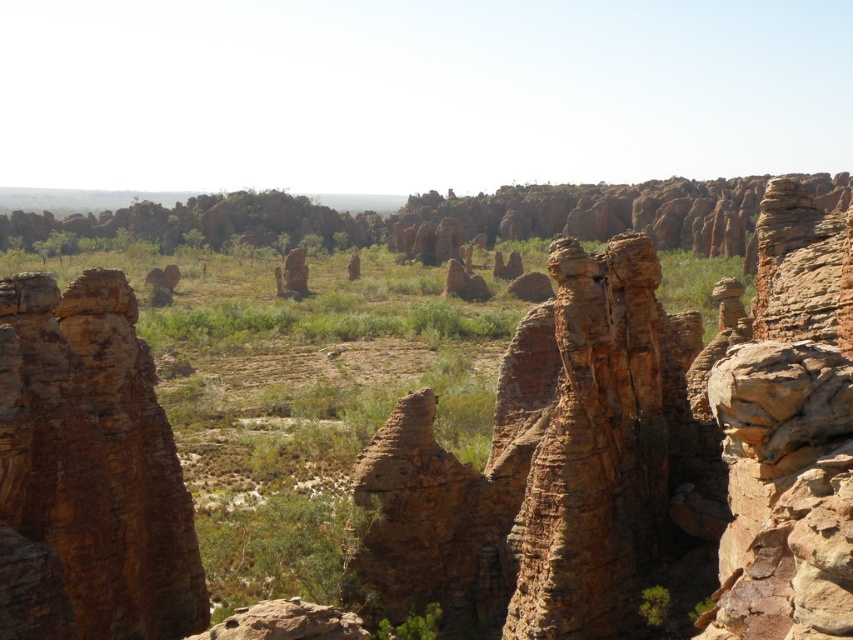
You are standing at the origin point of the coordinate system in this image. You want to locate the brown rough rock formation at center. In which direction should you look relative to your current position?

The brown rough rock formation at center is located at coordinate point 0.739 on the x axis and 0.104 on the y axis. Since you are at the origin, you should look towards the positive x and positive y direction to find it.

You are standing at the base of the tallest hoodoo formation and want to reach the green leafy shrub at lower center without stepping on any rocks. Which direction should you move relative to the green leafy bush at center?

You should move downward towards the green leafy shrub at lower center since it is positioned below the green leafy bush at center.

You are a botanist studying plant growth in arid environments. You notice two plants in the scene. Which one is taller, the green leafy bush at center or the green leafy shrub at lower center?

The green leafy bush at center is much taller than the green leafy shrub at lower center.